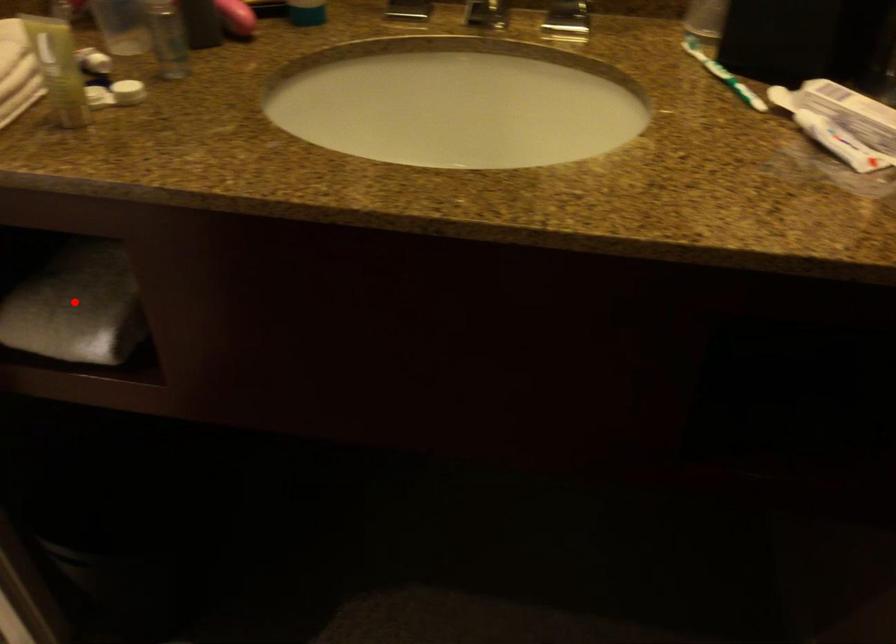
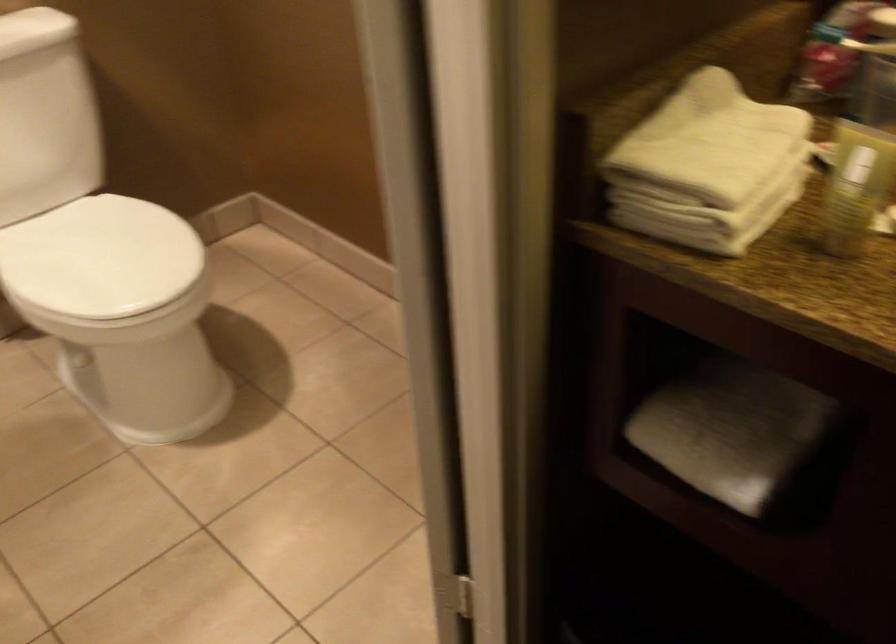
Question: I am providing you with two images of the same scene from different viewpoints. A red point is shown in image1. For the corresponding object point in image2, is it positioned nearer or farther from the camera?

Choices:
 (A) Nearer
 (B) Farther

Answer: (A)